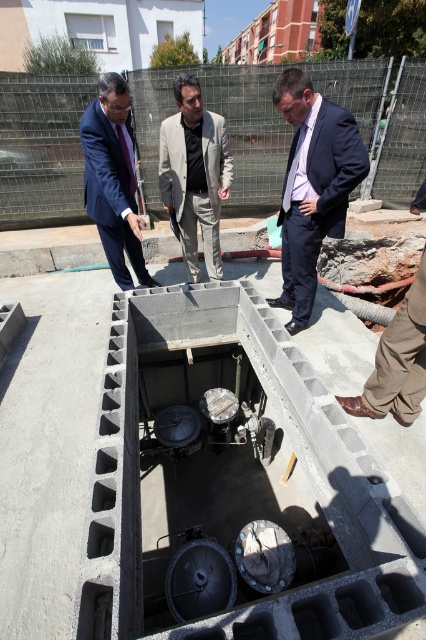
Is dark blue suit at center above dark blue suit at left?

No, dark blue suit at center is not above dark blue suit at left.

Based on the photo, can you confirm if dark blue suit at center is bigger than dark blue suit at left?

No, dark blue suit at center is not bigger than dark blue suit at left.

This screenshot has width=426, height=640. Describe the element at coordinates (313, 186) in the screenshot. I see `dark blue suit at center` at that location.

Where is `dark blue suit at center`? The height and width of the screenshot is (640, 426). dark blue suit at center is located at coordinates (313, 186).

Is light gray suit at center in front of dark blue suit at left?

That is False.

Who is more distant from viewer, (160,134) or (108,164)?

Point (160,134)

The image size is (426, 640). I want to click on light gray suit at center, so click(195, 173).

Describe the element at coordinates (313, 186) in the screenshot. This screenshot has width=426, height=640. I see `dark blue suit at center` at that location.

Can you confirm if dark blue suit at center is positioned below light gray suit at center?

Yes.

At what (x,y) coordinates should I click in order to perform the action: click on dark blue suit at center. Please return your answer as a coordinate pair (x, y). Looking at the image, I should click on (313, 186).